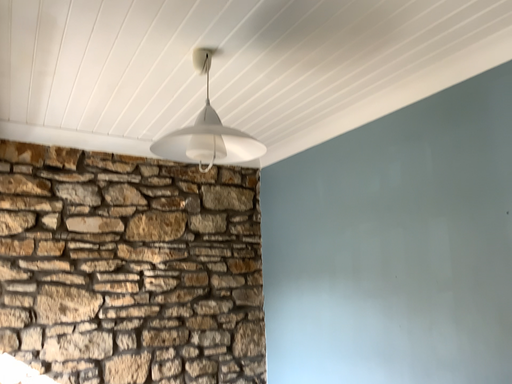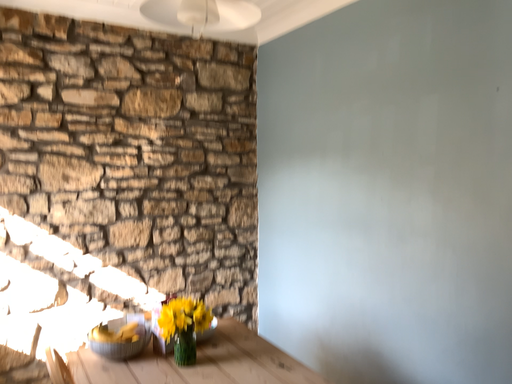
Question: How did the camera likely rotate when shooting the video?

Choices:
 (A) rotated downward
 (B) rotated upward

Answer: (A)